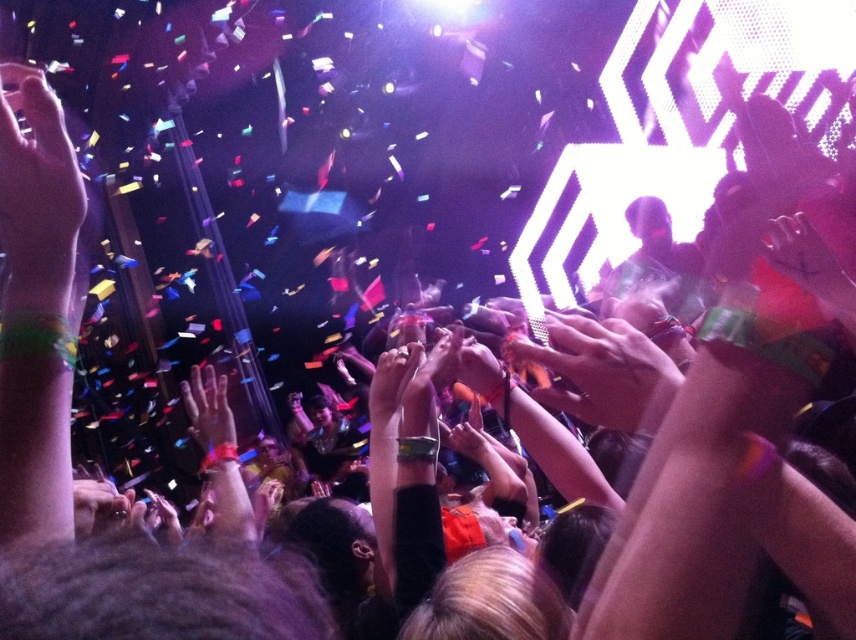
The width and height of the screenshot is (856, 640). What do you see at coordinates (37, 198) in the screenshot?
I see `matte skin hand at upper left` at bounding box center [37, 198].

What do you see at coordinates (37, 198) in the screenshot? I see `matte skin hand at upper left` at bounding box center [37, 198].

Where is `matte skin hand at upper left`? matte skin hand at upper left is located at coordinates (37, 198).